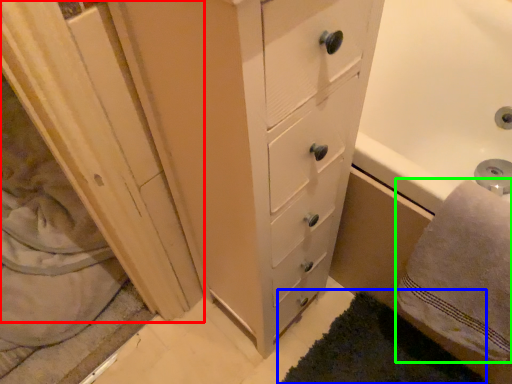
Question: Which is farther away from screen door (highlighted by a red box)? bath mat (highlighted by a blue box) or bath towel (highlighted by a green box)?

Choices:
 (A) bath mat
 (B) bath towel

Answer: (B)